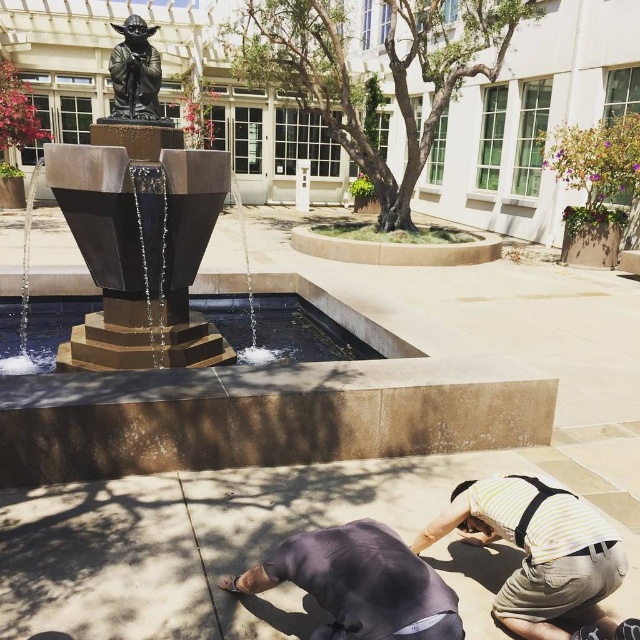
Is dark gray fabric squat at lower center shorter than bronze statue at center?

Yes, dark gray fabric squat at lower center is shorter than bronze statue at center.

Is dark gray fabric squat at lower center thinner than bronze statue at center?

Incorrect, dark gray fabric squat at lower center's width is not less than bronze statue at center's.

Identify the location of dark gray fabric squat at lower center. This screenshot has height=640, width=640. (358, 582).

This screenshot has width=640, height=640. Identify the location of dark gray fabric squat at lower center. click(x=358, y=582).

Between point (554, 604) and point (440, 609), which one is positioned behind?

The point (554, 604) is more distant.

Locate an element on the screen. The image size is (640, 640). yellow striped shirt at lower right is located at coordinates (540, 554).

Locate an element on the screen. This screenshot has height=640, width=640. yellow striped shirt at lower right is located at coordinates (540, 554).

Between yellow striped shirt at lower right and bronze statue at center, which one appears on the right side from the viewer's perspective?

yellow striped shirt at lower right

Who is higher up, yellow striped shirt at lower right or bronze statue at center?

bronze statue at center is higher up.

Locate an element on the screen. The image size is (640, 640). yellow striped shirt at lower right is located at coordinates (540, 554).